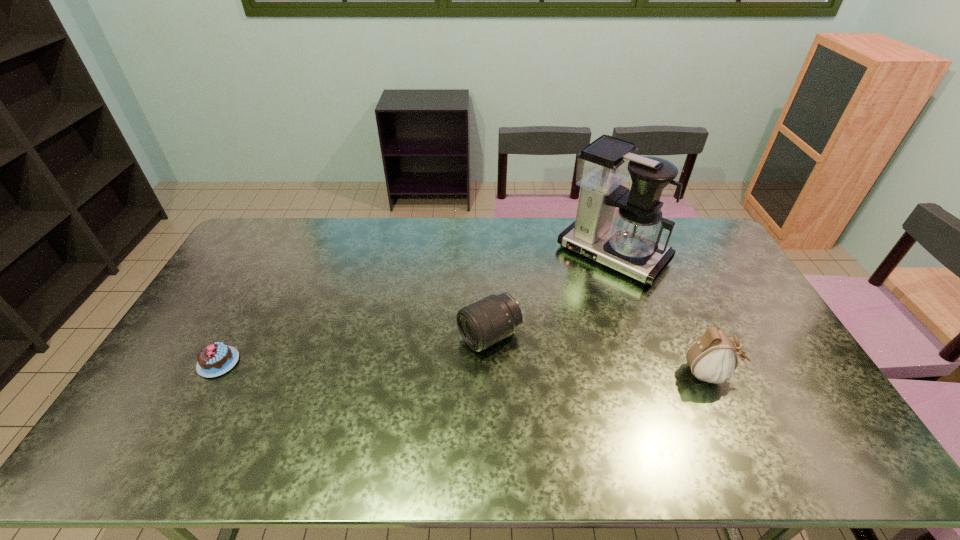
The width and height of the screenshot is (960, 540). What are the coordinates of `vacant space on the desktop that is between the chocolate cake and the third shortest object and is positioned at the front of the tallest object where the controls are located` in the screenshot? It's located at (503, 369).

You are a GUI agent. You are given a task and a screenshot of the screen. Output one action in this format:
    pyautogui.click(x=<x>, y=<y>)
    Task: Click on the free space on the desktop that is between the leftmost object and the pouch and is positioned on the surface of the second shortest object
    
    Given the screenshot: What is the action you would take?
    pyautogui.click(x=429, y=367)